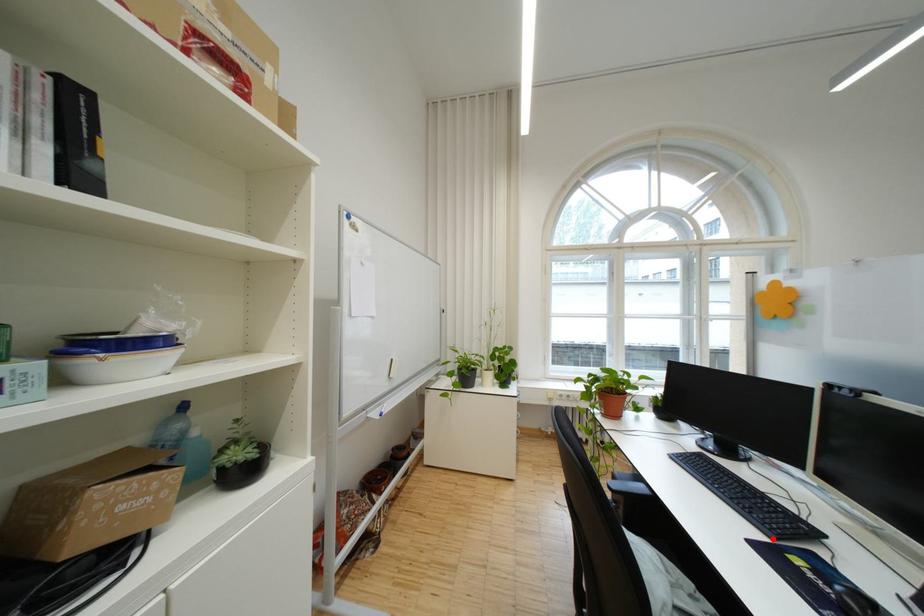
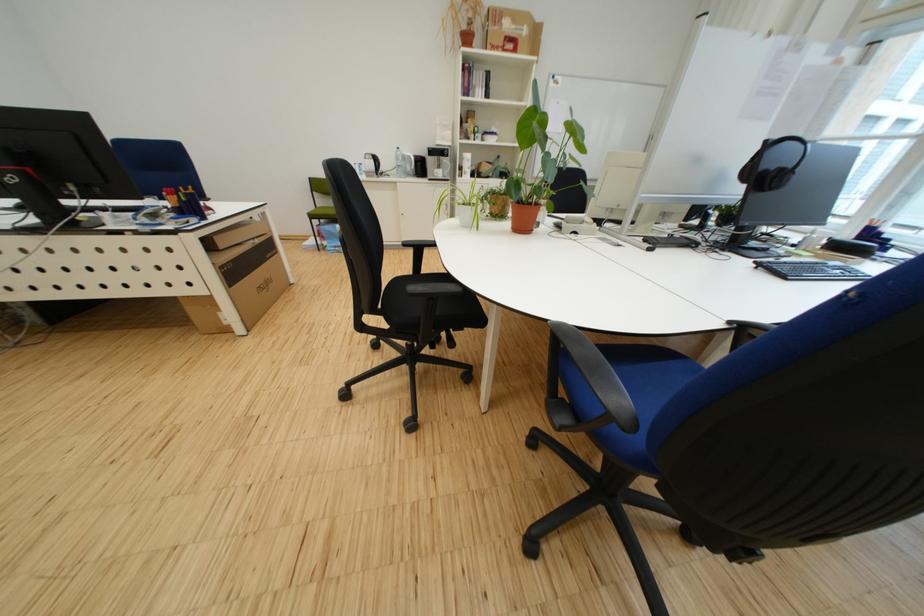
Question: I am providing you with two images of the same scene from different viewpoints. A red point is marked on the first image. At the location where the point appears in image 1, is it still visible in image 2?

Choices:
 (A) Yes
 (B) No

Answer: (B)